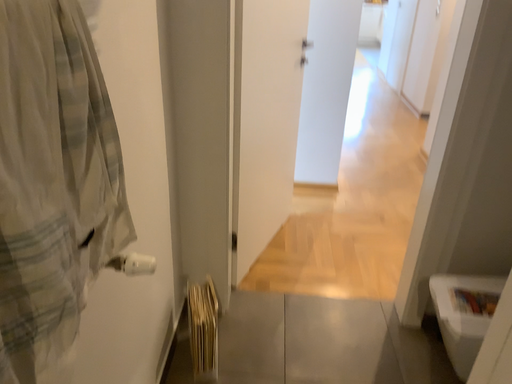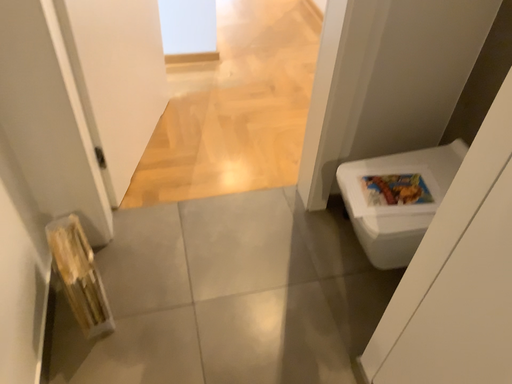
Question: How did the camera likely rotate when shooting the video?

Choices:
 (A) rotated downward
 (B) rotated upward

Answer: (A)